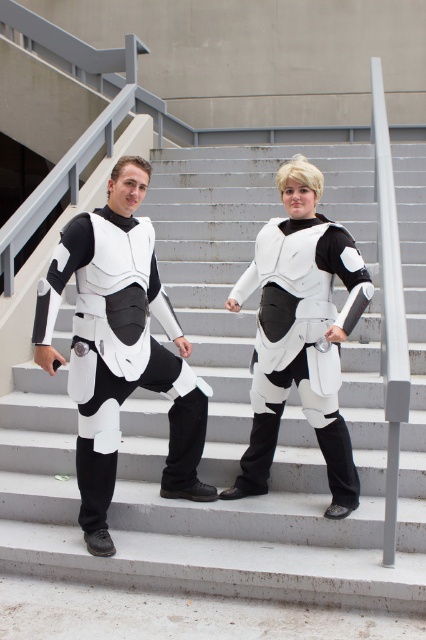
You are a costume designer trying to place a new accessory on the white smooth stairs at center and the matte white armor at center. Considering their sizes, which one can accommodate a larger accessory?

The white smooth stairs at center is larger in size than the matte white armor at center, so it can accommodate a larger accessory.

You are a photographer trying to capture a clear shot of both the white smooth stairs at center and the white matte armor at center. Which object should you focus on first if you want to ensure both are in focus without adjusting the camera settings?

The white smooth stairs at center is shorter than the white matte armor at center, so you should focus on the white matte armor at center first since it is farther away, allowing the depth of field to cover both objects.

You are a drone operator who needs to land a drone on the white smooth stairs at center. The drone has a maximum flight range of 3 meters. Based on the image, can the drone reach the stairs?

The distance between the white smooth stairs at center and the camera is 3.42 meters, which exceeds the drone maximum flight range of 3 meters. Therefore, the drone cannot reach the stairs.